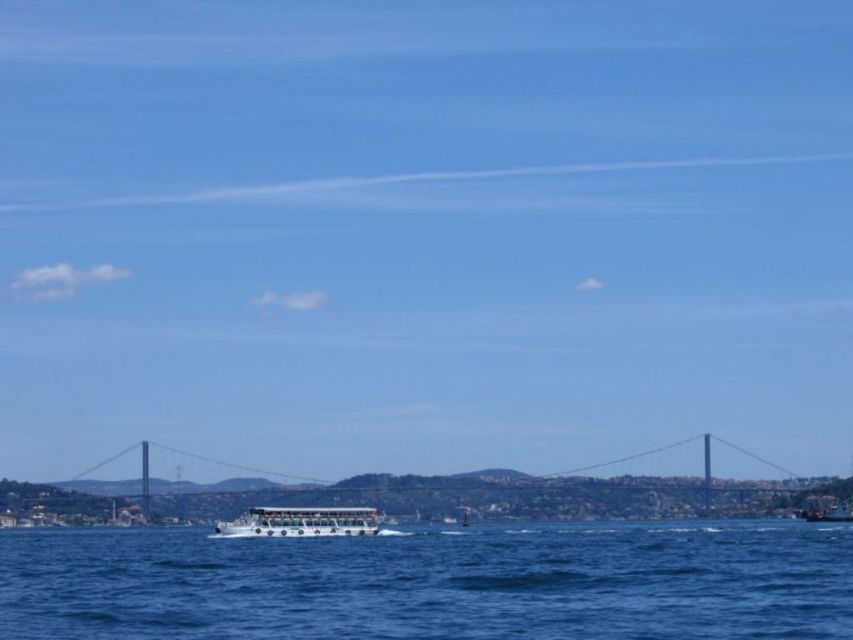
Which is more to the left, metallic gray bridge at center or white plastic boat at lower right?

Positioned to the left is metallic gray bridge at center.

What do you see at coordinates (498, 493) in the screenshot?
I see `metallic gray bridge at center` at bounding box center [498, 493].

Locate an element on the screen. Image resolution: width=853 pixels, height=640 pixels. metallic gray bridge at center is located at coordinates (498, 493).

Between blue water at center and metallic gray bridge at center, which one appears on the left side from the viewer's perspective?

blue water at center

Does point (799, 579) lie behind point (363, 476)?

That is False.

What do you see at coordinates (434, 582) in the screenshot? I see `blue water at center` at bounding box center [434, 582].

Locate an element on the screen. blue water at center is located at coordinates (434, 582).

Describe the element at coordinates (434, 582) in the screenshot. I see `blue water at center` at that location.

Does blue water at center appear on the left side of white glossy boat at center?

Incorrect, blue water at center is not on the left side of white glossy boat at center.

Does point (373, 618) come in front of point (341, 506)?

Yes, it is in front of point (341, 506).

Where is `blue water at center`? blue water at center is located at coordinates (434, 582).